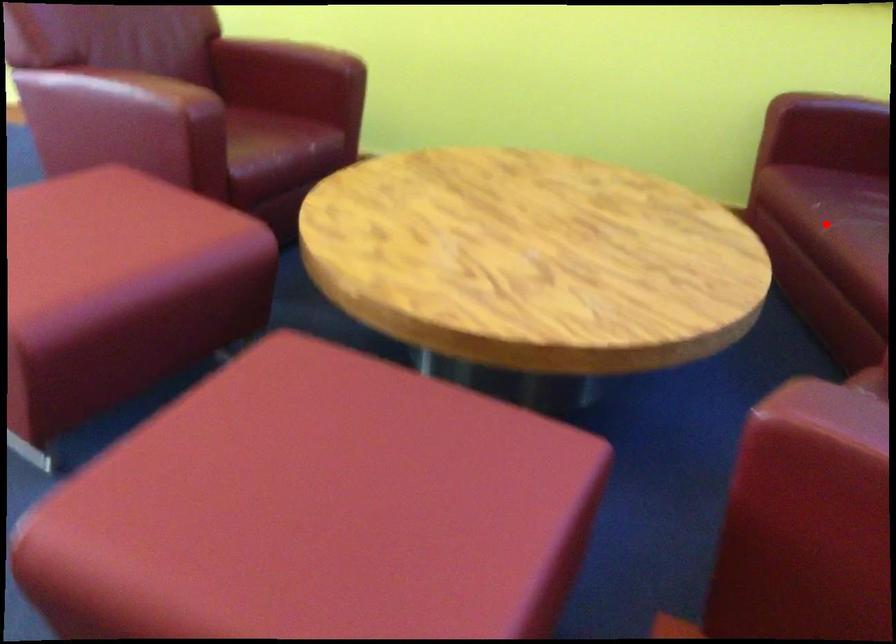
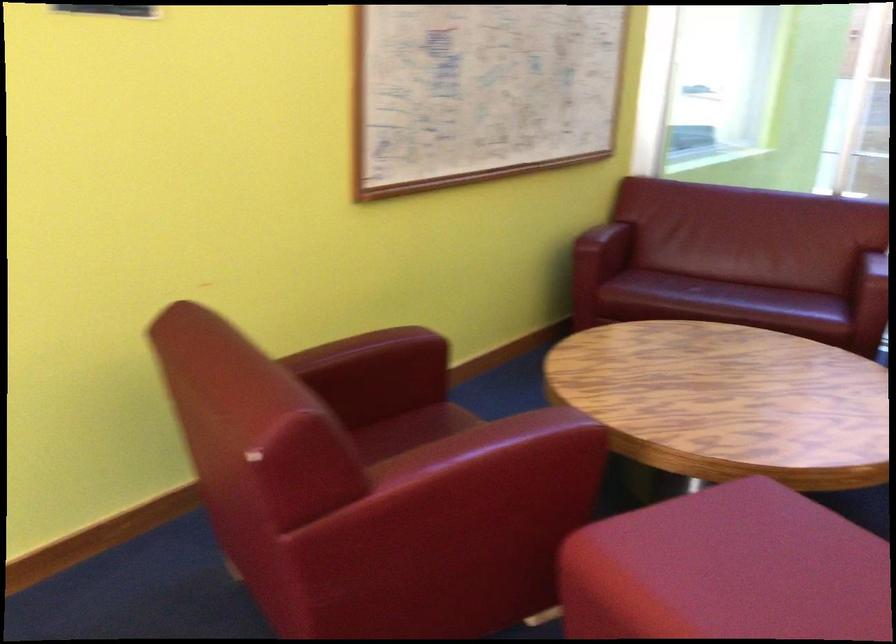
Question: I am providing you with two images of the same scene from different viewpoints. Image1 has a red point marked. In image2, the corresponding 3D location appears at what relative position? Reply with the corresponding letter.

Choices:
 (A) Closer
 (B) Farther

Answer: (B)